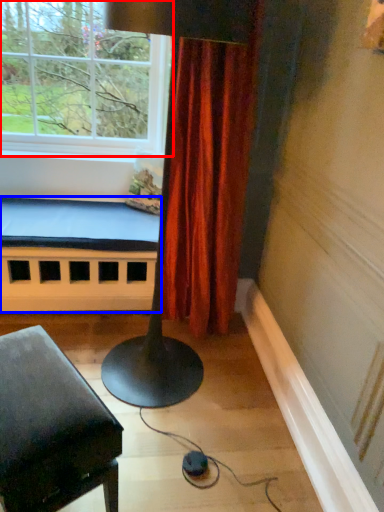
Question: Among these objects, which one is farthest to the camera, window (highlighted by a red box) or bed frame (highlighted by a blue box)?

Choices:
 (A) window
 (B) bed frame

Answer: (B)